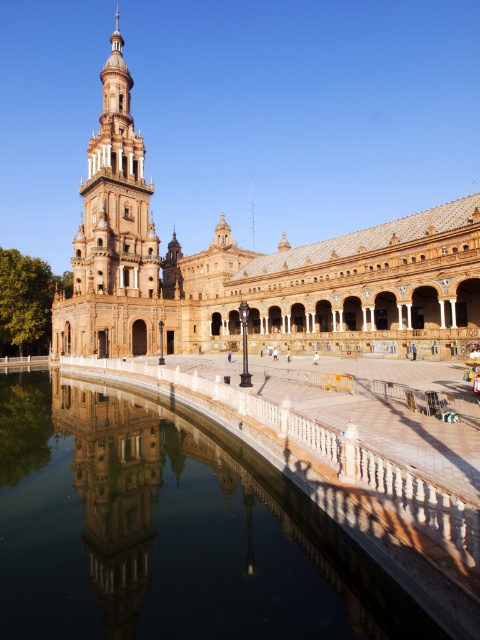
How distant is smooth reflective water at center from white stone tower at left?

They are 166.72 feet apart.

Who is taller, smooth reflective water at center or white stone tower at left?

Standing taller between the two is white stone tower at left.

Between point (10, 440) and point (108, 218), which one is positioned behind?

Positioned behind is point (108, 218).

Locate an element on the screen. This screenshot has width=480, height=640. smooth reflective water at center is located at coordinates (168, 531).

Does golden stone palace at left have a smaller size compared to white stone tower at left?

Incorrect, golden stone palace at left is not smaller in size than white stone tower at left.

What do you see at coordinates (254, 269) in the screenshot?
I see `golden stone palace at left` at bounding box center [254, 269].

This screenshot has width=480, height=640. What do you see at coordinates (254, 269) in the screenshot?
I see `golden stone palace at left` at bounding box center [254, 269].

Locate an element on the screen. golden stone palace at left is located at coordinates (254, 269).

Between smooth reflective water at center and golden stone palace at left, which one is positioned higher?

golden stone palace at left is higher up.

The image size is (480, 640). I want to click on smooth reflective water at center, so click(168, 531).